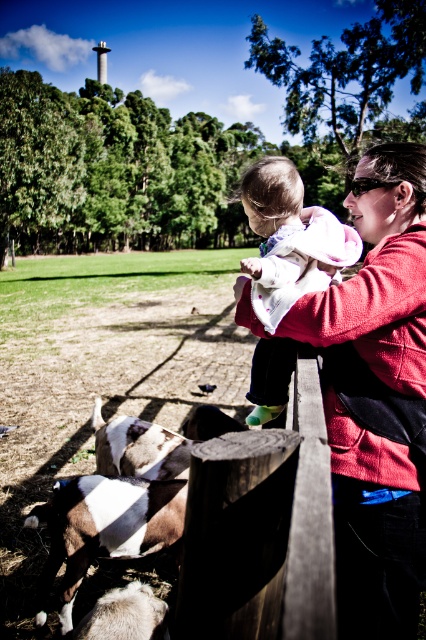
You are a photographer trying to capture the baby in the scene. The baby is represented by the point at location point (290, 241). Where should you position your camera to ensure the baby is centered in your shot?

To center the baby in your shot, position your camera so that the point at point (290, 241) is at the center of the frame.

You are a photographer trying to capture the white soft fur goat at lower left without the matte red sweater at upper right blocking the view. Can you adjust your position to achieve this?

The matte red sweater at upper right is positioned over the white soft fur goat at lower left, so moving your position to the left or right might allow you to avoid the sweater blocking the view of the goat.